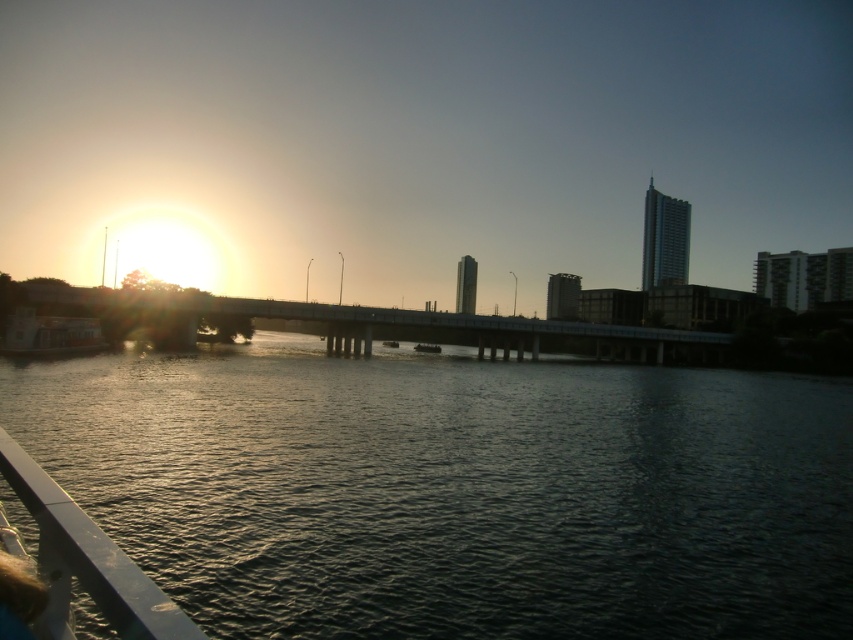
Is dark water at center bigger than concrete bridge at center?

No.

Does dark water at center have a lesser width compared to concrete bridge at center?

Indeed, dark water at center has a lesser width compared to concrete bridge at center.

This screenshot has width=853, height=640. What do you see at coordinates (456, 490) in the screenshot?
I see `dark water at center` at bounding box center [456, 490].

You are a GUI agent. You are given a task and a screenshot of the screen. Output one action in this format:
    pyautogui.click(x=<x>, y=<y>)
    Task: Click on the dark water at center
    
    Given the screenshot: What is the action you would take?
    pyautogui.click(x=456, y=490)

Between dark water at center and metallic silver boat at lower left, which one appears on the left side from the viewer's perspective?

From the viewer's perspective, metallic silver boat at lower left appears more on the left side.

Does dark water at center appear over metallic silver boat at lower left?

No, dark water at center is not above metallic silver boat at lower left.

Is point (548, 557) closer to viewer compared to point (99, 346)?

Yes, point (548, 557) is in front of point (99, 346).

Locate an element on the screen. The width and height of the screenshot is (853, 640). dark water at center is located at coordinates (456, 490).

Between concrete bridge at center and metallic silver boat at lower left, which one is positioned lower?

concrete bridge at center is lower down.

Is point (86, 310) positioned in front of point (33, 332)?

That is False.

Locate an element on the screen. This screenshot has width=853, height=640. concrete bridge at center is located at coordinates (399, 324).